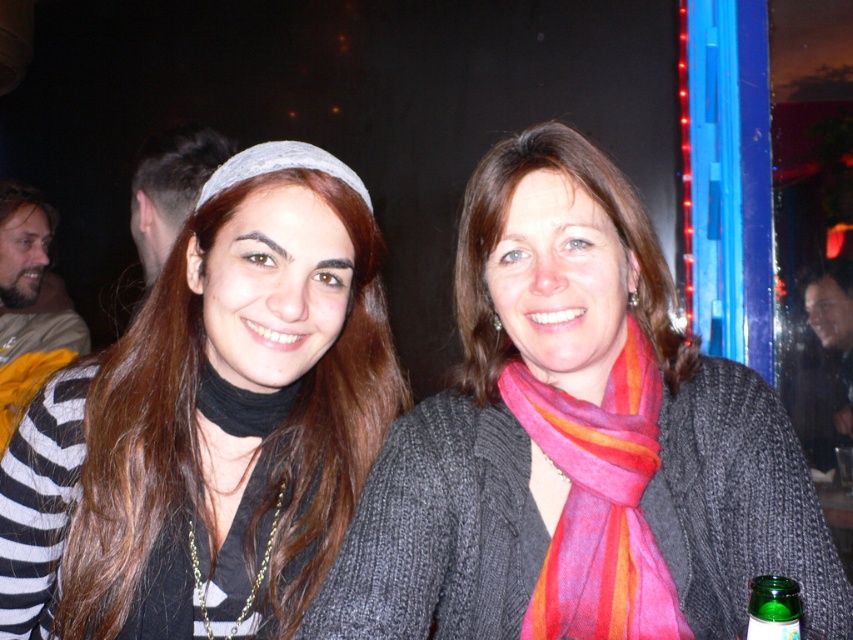
Question: Which object is the farthest from the green glass bottle at lower right?

Choices:
 (A) matte black headband at upper left
 (B) striped wool scarf at center

Answer: (A)

Question: Is the position of matte black headband at upper left more distant than that of striped wool scarf at center?

Choices:
 (A) yes
 (B) no

Answer: (B)

Question: Among these objects, which one is nearest to the camera?

Choices:
 (A) striped wool scarf at center
 (B) knitted gray sweater at center
 (C) matte black headband at upper left
 (D) green glass bottle at lower right

Answer: (D)

Question: From the image, what is the correct spatial relationship of matte black headband at upper left in relation to striped wool scarf at center?

Choices:
 (A) left
 (B) right

Answer: (A)

Question: Which point is closer to the camera?

Choices:
 (A) (757, 625)
 (B) (663, 636)
 (C) (653, 298)

Answer: (A)

Question: Does matte black headband at upper left lie in front of striped wool scarf at center?

Choices:
 (A) yes
 (B) no

Answer: (A)